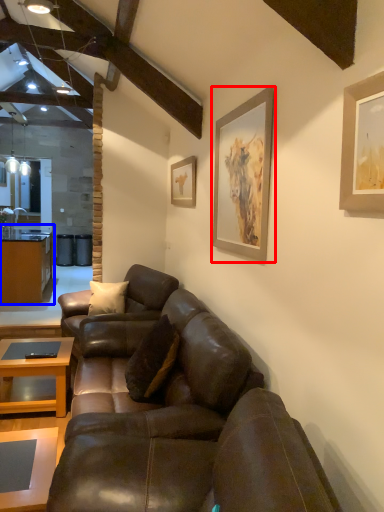
Question: Which point is closer to the camera, picture frame (highlighted by a red box) or cabinetry (highlighted by a blue box)?

Choices:
 (A) picture frame
 (B) cabinetry

Answer: (A)